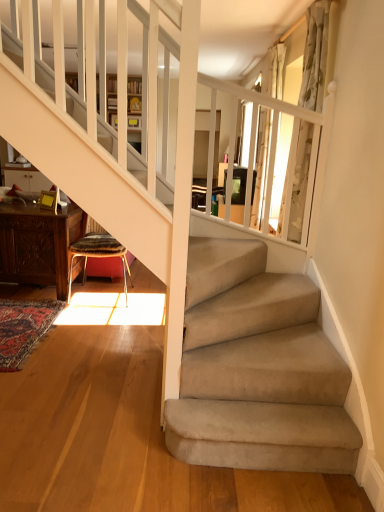
Question: Considering the positions of patterned fabric stool at lower left and carved wood table at lower left in the image, is patterned fabric stool at lower left wider or thinner than carved wood table at lower left?

Choices:
 (A) wide
 (B) thin

Answer: (B)

Question: From the image's perspective, is patterned fabric stool at lower left located above or below carved wood table at lower left?

Choices:
 (A) below
 (B) above

Answer: (A)

Question: Which of these objects is positioned farthest from the white sheer curtain at upper right, the 2th curtain from the front?

Choices:
 (A) white floral fabric curtain at upper right, the first curtain when ordered from front to back
 (B) carved wood table at lower left
 (C) patterned fabric stool at lower left

Answer: (B)

Question: Which object is positioned farthest from the patterned fabric stool at lower left?

Choices:
 (A) carved wood table at lower left
 (B) white floral fabric curtain at upper right, the first curtain when ordered from front to back
 (C) white sheer curtain at upper right, which is the first curtain in back-to-front order

Answer: (B)